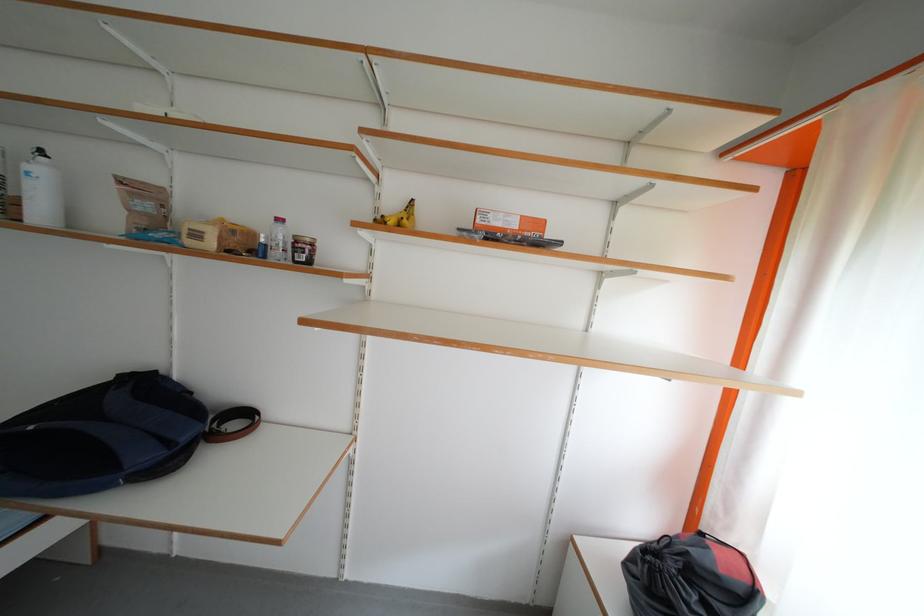
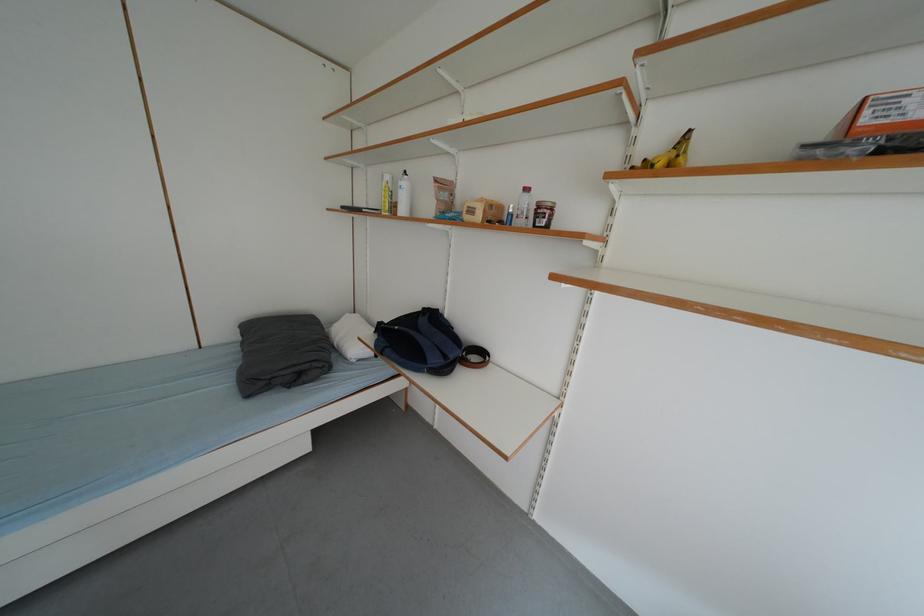
Question: The camera is either moving clockwise (left) or counter-clockwise (right) around the object. The first image is from the beginning of the video and the second image is from the end. Is the camera moving left or right when shooting the video?

Choices:
 (A) Left
 (B) Right

Answer: (B)